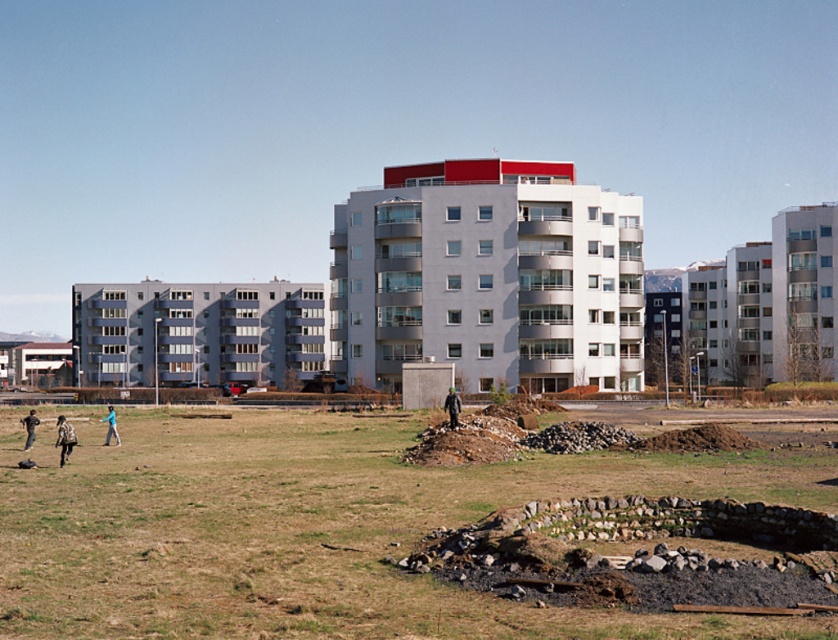
Who is lower down, brown grass at center or dark gray jacket at lower left?

dark gray jacket at lower left is below.

Can you confirm if brown grass at center is thinner than dark gray jacket at lower left?

Incorrect, brown grass at center's width is not less than dark gray jacket at lower left's.

Image resolution: width=838 pixels, height=640 pixels. I want to click on brown grass at center, so click(x=318, y=528).

Can you confirm if dark gray jacket at center is wider than dark gray jacket at lower left?

In fact, dark gray jacket at center might be narrower than dark gray jacket at lower left.

Is point (454, 412) closer to viewer compared to point (30, 422)?

No, it is not.

I want to click on dark gray jacket at center, so click(x=453, y=406).

Does camouflage-patterned shirt at lower left lie behind dark gray jacket at lower left?

No, it is in front of dark gray jacket at lower left.

Which is in front, point (68, 440) or point (30, 442)?

Point (68, 440) is in front.

You are a GUI agent. You are given a task and a screenshot of the screen. Output one action in this format:
    pyautogui.click(x=<x>, y=<y>)
    Task: Click on the camouflage-patterned shirt at lower left
    The width and height of the screenshot is (838, 640).
    Given the screenshot: What is the action you would take?
    pyautogui.click(x=65, y=438)